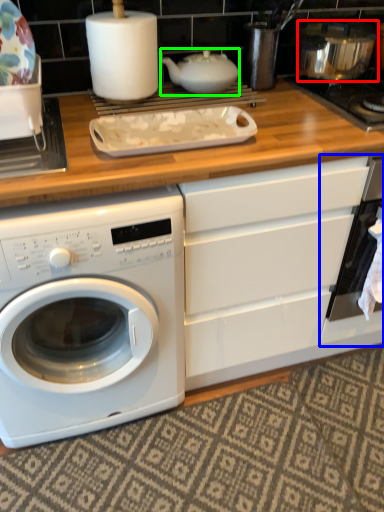
Question: Estimate the real-world distances between objects in this image. Which object is farther from appliance (highlighted by a red box), oven (highlighted by a blue box) or tea pot (highlighted by a green box)?

Choices:
 (A) oven
 (B) tea pot

Answer: (A)